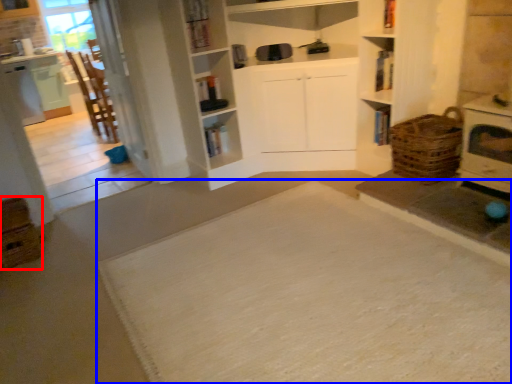
Question: Among these objects, which one is nearest to the camera, crate (highlighted by a red box) or doormat (highlighted by a blue box)?

Choices:
 (A) crate
 (B) doormat

Answer: (B)